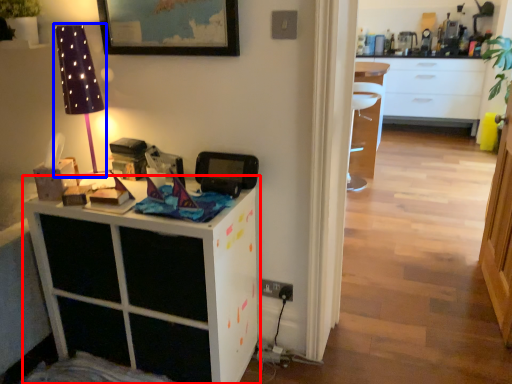
Question: Which of the following is the farthest to the observer, cabinetry (highlighted by a red box) or table lamp (highlighted by a blue box)?

Choices:
 (A) cabinetry
 (B) table lamp

Answer: (B)